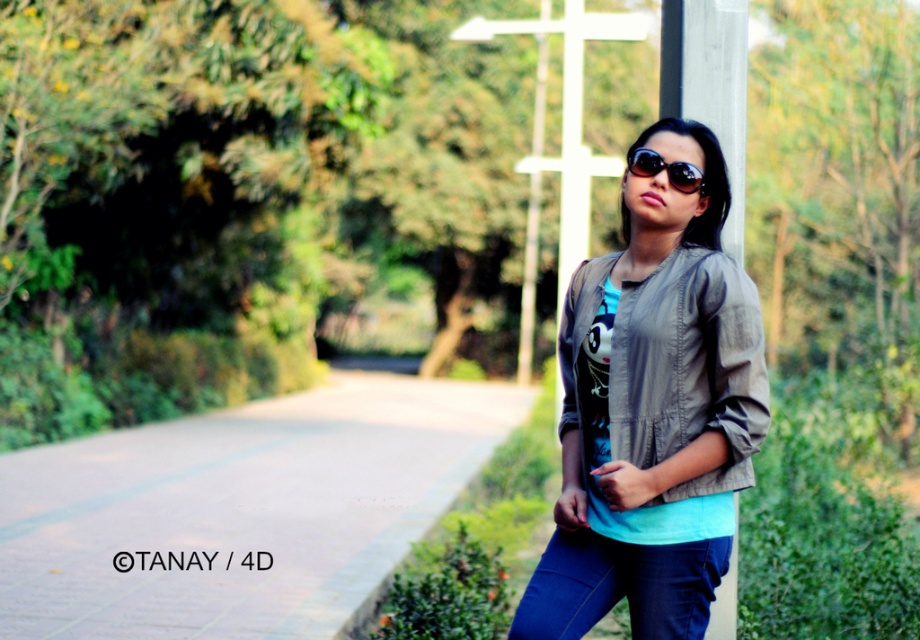
You are designing a new outfit and want to ensure it will look balanced when worn next to a gray wood pole at center. Given that the matte gray jacket at center is part of your design, how does its width compare to the pole?

The matte gray jacket at center has a larger width than the gray wood pole at center, so it will appear more expansive when worn next to the pole.

You are a photographer trying to capture a shot of the matte gray jacket at center and the white wooden cross at center. You want to ensure both are in the frame. Based on their positions, which object should you place closer to the left side of your camera viewfinder?

The matte gray jacket at center is positioned on the left side of the white wooden cross at center, so you should place the matte gray jacket at center closer to the left side of your camera viewfinder to include both in the frame.

Based on the scene description, where is the matte gray jacket at center located in terms of its 2D coordinates?

The matte gray jacket at center is located at the 2D coordinates point (652, 412).